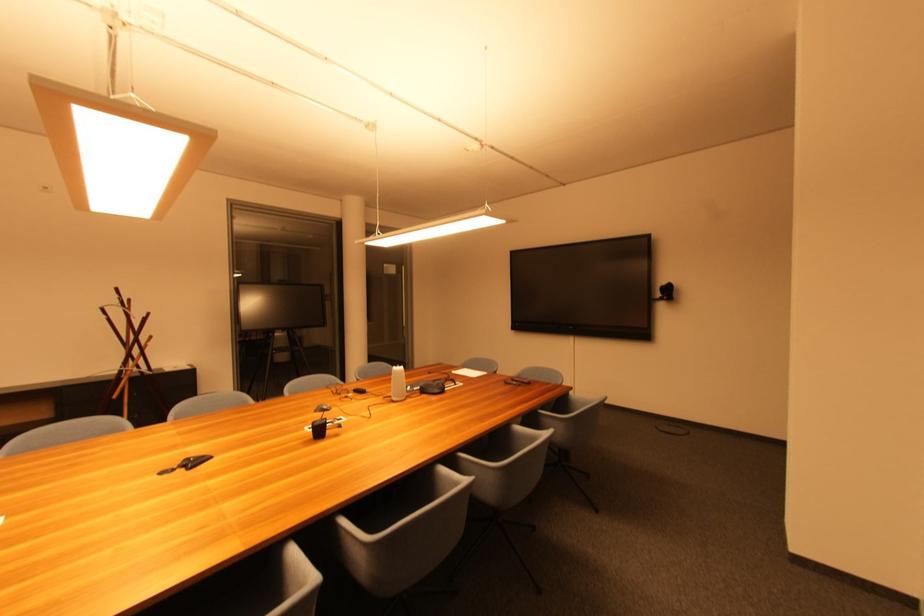
You are a GUI agent. You are given a task and a screenshot of the screen. Output one action in this format:
    pyautogui.click(x=<x>, y=<y>)
    Task: Click on the white cylindrical speaker
    The width and height of the screenshot is (924, 616).
    Given the screenshot: What is the action you would take?
    pyautogui.click(x=397, y=383)